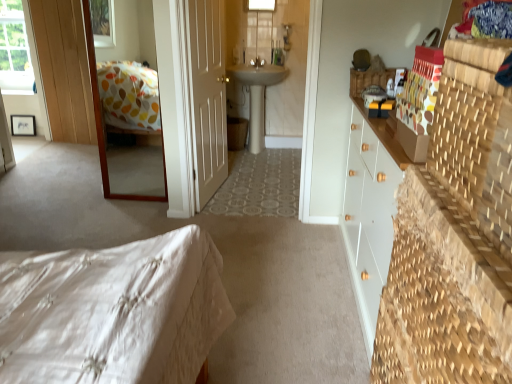
Question: From a real-world perspective, is white quilted bed at lower left below transparent glass window at upper center, which is the 1th window in front-to-back order?

Choices:
 (A) no
 (B) yes

Answer: (B)

Question: Considering the relative sizes of white quilted bed at lower left and transparent glass window at upper center, which is the 1th window in front-to-back order, in the image provided, is white quilted bed at lower left taller than transparent glass window at upper center, which is the 1th window in front-to-back order,?

Choices:
 (A) yes
 (B) no

Answer: (A)

Question: Can you confirm if white quilted bed at lower left is shorter than transparent glass window at upper center, which ranks as the second window in back-to-front order?

Choices:
 (A) yes
 (B) no

Answer: (B)

Question: Would you say white quilted bed at lower left contains transparent glass window at upper center, which is the 1th window in front-to-back order?

Choices:
 (A) no
 (B) yes

Answer: (A)

Question: Is the depth of white quilted bed at lower left greater than that of transparent glass window at upper center, placed as the first window when sorted from right to left?

Choices:
 (A) no
 (B) yes

Answer: (A)

Question: Does white quilted bed at lower left appear on the left side of transparent glass window at upper center, which is the 1th window in front-to-back order?

Choices:
 (A) yes
 (B) no

Answer: (A)

Question: From the image's perspective, is white matte door at center on transparent glass window at upper center, the second window when ordered from left to right?

Choices:
 (A) no
 (B) yes

Answer: (A)

Question: From the image's perspective, is white matte door at center beneath transparent glass window at upper center, which ranks as the second window in back-to-front order?

Choices:
 (A) yes
 (B) no

Answer: (A)

Question: Is white matte door at center aimed at transparent glass window at upper center, which ranks as the second window in back-to-front order?

Choices:
 (A) yes
 (B) no

Answer: (B)

Question: Considering the relative sizes of white matte door at center and transparent glass window at upper center, which is the 1th window in front-to-back order, in the image provided, is white matte door at center thinner than transparent glass window at upper center, which is the 1th window in front-to-back order,?

Choices:
 (A) no
 (B) yes

Answer: (A)

Question: From a real-world perspective, is white matte door at center physically below transparent glass window at upper center, placed as the first window when sorted from right to left?

Choices:
 (A) no
 (B) yes

Answer: (B)

Question: Is white matte door at center bigger than transparent glass window at upper center, which ranks as the second window in back-to-front order?

Choices:
 (A) no
 (B) yes

Answer: (B)

Question: Is transparent glass window at upper left, the 1th window in the left-to-right sequence, positioned behind white quilted bed at lower left?

Choices:
 (A) no
 (B) yes

Answer: (B)